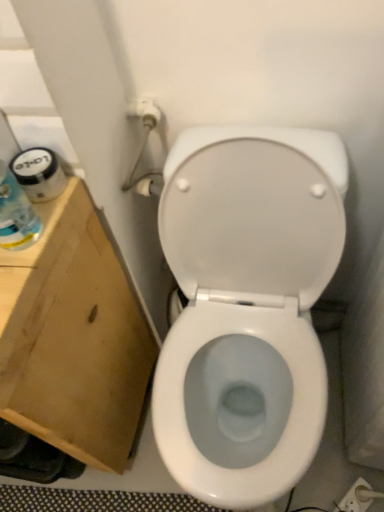
At what (x,y) coordinates should I click in order to perform the action: click on translucent plastic bottle at left. Please return your answer as a coordinate pair (x, y). Looking at the image, I should click on (16, 214).

What is the approximate height of white glossy toilet at center?

The height of white glossy toilet at center is 29.74 inches.

The width and height of the screenshot is (384, 512). What do you see at coordinates (247, 307) in the screenshot?
I see `white glossy toilet at center` at bounding box center [247, 307].

Locate an element on the screen. brown cardboard at left is located at coordinates (73, 338).

At what (x,y) coordinates should I click in order to perform the action: click on translucent plastic bottle at left. Please return your answer as a coordinate pair (x, y). Looking at the image, I should click on (16, 214).

At what (x,y) coordinates should I click in order to perform the action: click on cardboard box on the left of translucent plastic bottle at left. Please return your answer as a coordinate pair (x, y). Looking at the image, I should click on (73, 338).

Who is bigger, translucent plastic bottle at left or brown cardboard at left?

Bigger between the two is brown cardboard at left.

Is translucent plastic bottle at left closer to camera compared to brown cardboard at left?

Yes, translucent plastic bottle at left is in front of brown cardboard at left.

Is brown cardboard at left at the back of translucent plastic bottle at left?

translucent plastic bottle at left does not have its back to brown cardboard at left.

Can you confirm if white glossy toilet at center is bigger than white plastic electric outlet at lower right?

Yes.

In the scene shown: From a real-world perspective, is white glossy toilet at center physically located above or below white plastic electric outlet at lower right?

In terms of real-world spatial position, white glossy toilet at center is above white plastic electric outlet at lower right.

Choose the correct answer: Is white glossy toilet at center inside white plastic electric outlet at lower right or outside it?

white glossy toilet at center is not inside white plastic electric outlet at lower right, it's outside.

In the scene shown: Which is behind, white glossy toilet at center or white plastic electric outlet at lower right?

white plastic electric outlet at lower right.

You are a GUI agent. You are given a task and a screenshot of the screen. Output one action in this format:
    pyautogui.click(x=<x>, y=<y>)
    Task: Click on the electric outlet located below the white glossy toilet at center (from the image's perspective)
    This screenshot has height=512, width=384.
    Given the screenshot: What is the action you would take?
    click(x=358, y=497)

Between white plastic electric outlet at lower right and white glossy toilet at center, which one has larger size?

Bigger between the two is white glossy toilet at center.

Considering the sizes of objects white plastic electric outlet at lower right and white glossy toilet at center in the image provided, who is shorter, white plastic electric outlet at lower right or white glossy toilet at center?

white plastic electric outlet at lower right is shorter.

Is brown cardboard at left at the back of white plastic electric outlet at lower right?

white plastic electric outlet at lower right is not turned away from brown cardboard at left.

From a real-world perspective, is white plastic electric outlet at lower right physically located above or below brown cardboard at left?

In terms of real-world spatial position, white plastic electric outlet at lower right is below brown cardboard at left.

Which of these two, white plastic electric outlet at lower right or brown cardboard at left, stands taller?

Standing taller between the two is brown cardboard at left.

Consider the image. Who is smaller, brown cardboard at left or white plastic electric outlet at lower right?

white plastic electric outlet at lower right.

Is brown cardboard at left taller than white plastic electric outlet at lower right?

Indeed, brown cardboard at left has a greater height compared to white plastic electric outlet at lower right.

Which point is more distant from viewer, (146, 352) or (343, 506)?

The point (146, 352) is farther.

In the image, there is a brown cardboard at left. Where is `electric outlet below it (from the image's perspective)`? Image resolution: width=384 pixels, height=512 pixels. electric outlet below it (from the image's perspective) is located at coordinates (358, 497).

Which object is thinner, brown cardboard at left or white glossy toilet at center?

Thinner between the two is brown cardboard at left.

In the scene shown: Is brown cardboard at left outside of white glossy toilet at center?

brown cardboard at left lies outside white glossy toilet at center's area.

From the image's perspective, which one is positioned higher, brown cardboard at left or white glossy toilet at center?

white glossy toilet at center.

Consider the image. In the image, is brown cardboard at left positioned in front of or behind white glossy toilet at center?

In the image, brown cardboard at left appears behind white glossy toilet at center.

Are translucent plastic bottle at left and white plastic electric outlet at lower right beside each other?

No, translucent plastic bottle at left is not in contact with white plastic electric outlet at lower right.

From a real-world perspective, is translucent plastic bottle at left over white plastic electric outlet at lower right?

Yes.

Which object is further away from the camera taking this photo, translucent plastic bottle at left or white plastic electric outlet at lower right?

white plastic electric outlet at lower right is behind.

Identify the location of bottle above the white plastic electric outlet at lower right (from a real-world perspective). Image resolution: width=384 pixels, height=512 pixels. (16, 214).

Where is `cardboard box that appears below the translucent plastic bottle at left (from the image's perspective)`? This screenshot has height=512, width=384. cardboard box that appears below the translucent plastic bottle at left (from the image's perspective) is located at coordinates (73, 338).

You are a GUI agent. You are given a task and a screenshot of the screen. Output one action in this format:
    pyautogui.click(x=<x>, y=<y>)
    Task: Click on the electric outlet located on the right of white glossy toilet at center
    The height and width of the screenshot is (512, 384).
    Given the screenshot: What is the action you would take?
    pyautogui.click(x=358, y=497)

Based on their spatial positions, is translucent plastic bottle at left or white plastic electric outlet at lower right further from brown cardboard at left?

white plastic electric outlet at lower right.

Looking at the image, which one is located closer to brown cardboard at left, white glossy toilet at center or white plastic electric outlet at lower right?

The object closer to brown cardboard at left is white glossy toilet at center.

Looking at the image, which one is located further to white plastic electric outlet at lower right, brown cardboard at left or translucent plastic bottle at left?

The object further to white plastic electric outlet at lower right is translucent plastic bottle at left.

Looking at the image, which one is located closer to translucent plastic bottle at left, brown cardboard at left or white glossy toilet at center?

Among the two, brown cardboard at left is located nearer to translucent plastic bottle at left.

Considering their positions, is brown cardboard at left positioned closer to white plastic electric outlet at lower right than white glossy toilet at center?

white glossy toilet at center is closer to white plastic electric outlet at lower right.

When comparing their distances from translucent plastic bottle at left, does white glossy toilet at center or white plastic electric outlet at lower right seem further?

Among the two, white plastic electric outlet at lower right is located further to translucent plastic bottle at left.

Estimate the real-world distances between objects in this image. Which object is closer to brown cardboard at left, translucent plastic bottle at left or white glossy toilet at center?

The object closer to brown cardboard at left is white glossy toilet at center.

Based on their spatial positions, is brown cardboard at left or translucent plastic bottle at left closer to white glossy toilet at center?

brown cardboard at left is closer to white glossy toilet at center.

What are the coordinates of `bottle located between brown cardboard at left and white glossy toilet at center in the left-right direction` in the screenshot? It's located at (16, 214).

Find the location of a particular element. This screenshot has width=384, height=512. toilet that lies between translucent plastic bottle at left and white plastic electric outlet at lower right from top to bottom is located at coordinates (247, 307).

Where is `toilet between brown cardboard at left and white plastic electric outlet at lower right from left to right`? This screenshot has width=384, height=512. toilet between brown cardboard at left and white plastic electric outlet at lower right from left to right is located at coordinates (247, 307).

The image size is (384, 512). Identify the location of bottle located between brown cardboard at left and white plastic electric outlet at lower right in the left-right direction. (16, 214).